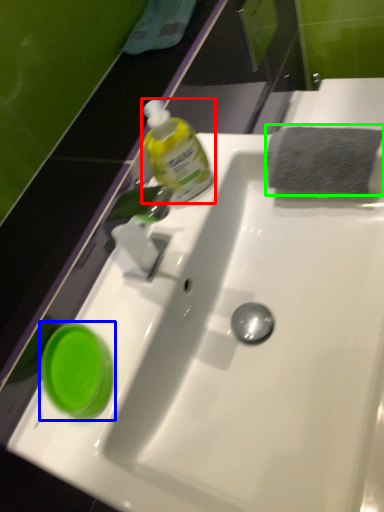
Question: Based on their relative distances, which object is nearer to bottle (highlighted by a red box)? Choose from teal (highlighted by a blue box) and hand towel (highlighted by a green box).

Choices:
 (A) teal
 (B) hand towel

Answer: (B)